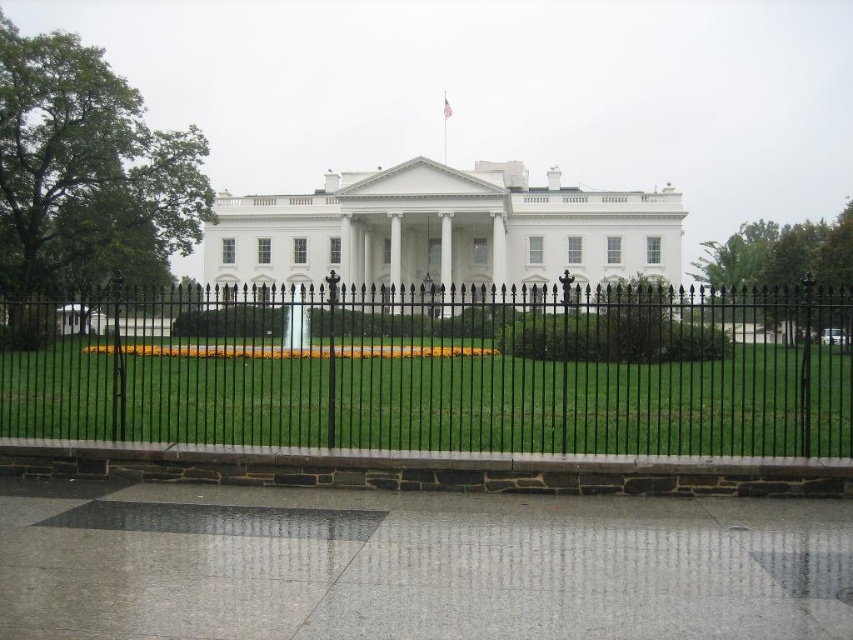
You are standing at the camera position facing the grand white building. There is a point marked at coordinates point (x=379, y=308). Can you walk directly to that point without crossing any obstacles?

The point (x=379, y=308) is 232.35 feet away from the camera. Since the path to the point is across the well maintained lawn and there are no mentioned obstacles between you and the point, you can walk directly to the point without crossing any obstacles.